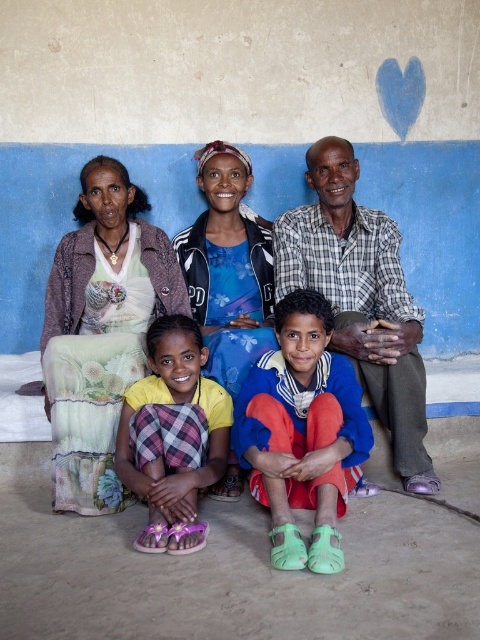
Who is taller, matte black jacket at center or blue floral shirt at center?

With more height is matte black jacket at center.

Describe the element at coordinates (370, 300) in the screenshot. I see `matte black jacket at center` at that location.

Is point (320, 532) less distant than point (244, 300)?

Yes.

Find the location of `matte black jacket at center`. matte black jacket at center is located at coordinates (370, 300).

Can you confirm if blue fabric pants at lower center is positioned above yellow plaid skirt at lower left?

Yes.

Where is `blue fabric pants at lower center`? The height and width of the screenshot is (640, 480). blue fabric pants at lower center is located at coordinates (302, 433).

Does matte black jacket at center appear on the left side of blue fabric pants at lower center?

Indeed, matte black jacket at center is positioned on the left side of blue fabric pants at lower center.

Who is taller, matte black jacket at center or blue fabric pants at lower center?

matte black jacket at center is taller.

At what (x,y) coordinates should I click in order to perform the action: click on matte black jacket at center. Please return your answer as a coordinate pair (x, y). The width and height of the screenshot is (480, 640). Looking at the image, I should click on (370, 300).